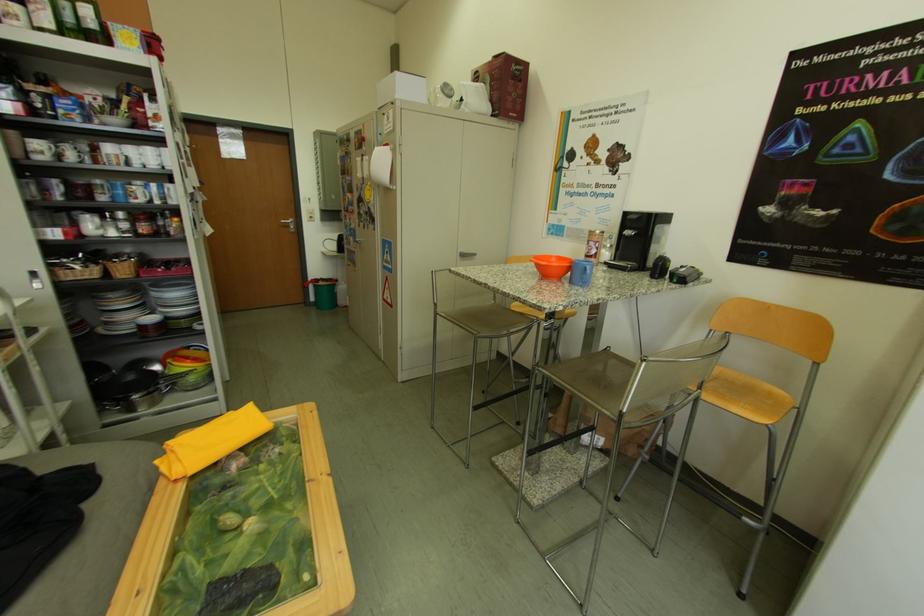
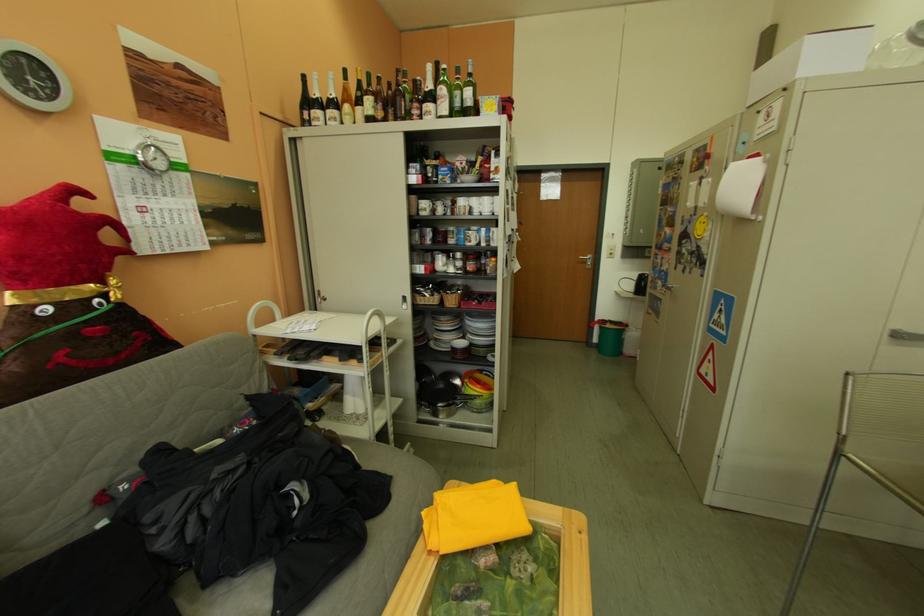
Find the pixel in the second image that matches (472,259) in the first image.

(903, 338)